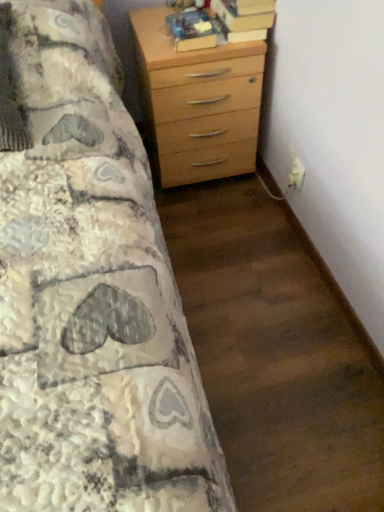
Question: Considering the relative sizes of hardcover book at upper right, the 2th book positioned from the left, and hardcover book at upper center, which ranks as the 1th book in left-to-right order, in the image provided, is hardcover book at upper right, the 2th book positioned from the left, shorter than hardcover book at upper center, which ranks as the 1th book in left-to-right order,?

Choices:
 (A) yes
 (B) no

Answer: (A)

Question: From the image's perspective, is hardcover book at upper right, the 2th book positioned from the left, located beneath hardcover book at upper center, marked as the second book in a right-to-left arrangement?

Choices:
 (A) yes
 (B) no

Answer: (B)

Question: Considering the relative sizes of hardcover book at upper right, the 2th book positioned from the left, and hardcover book at upper center, which ranks as the 1th book in left-to-right order, in the image provided, is hardcover book at upper right, the 2th book positioned from the left, taller than hardcover book at upper center, which ranks as the 1th book in left-to-right order,?

Choices:
 (A) yes
 (B) no

Answer: (B)

Question: From a real-world perspective, is hardcover book at upper right, placed as the 1th book when sorted from right to left, over hardcover book at upper center, which ranks as the 1th book in left-to-right order?

Choices:
 (A) yes
 (B) no

Answer: (A)

Question: Does hardcover book at upper right, the 2th book positioned from the left, have a larger size compared to hardcover book at upper center, marked as the second book in a right-to-left arrangement?

Choices:
 (A) no
 (B) yes

Answer: (B)

Question: In terms of size, does light wood chest of drawers at upper right appear bigger or smaller than hardcover book at upper right, placed as the 1th book when sorted from right to left?

Choices:
 (A) big
 (B) small

Answer: (A)

Question: Would you say light wood chest of drawers at upper right is to the left or to the right of hardcover book at upper right, the 2th book positioned from the left, in the picture?

Choices:
 (A) right
 (B) left

Answer: (B)

Question: Considering the positions of light wood chest of drawers at upper right and hardcover book at upper right, the 2th book positioned from the left, in the image, is light wood chest of drawers at upper right wider or thinner than hardcover book at upper right, the 2th book positioned from the left,?

Choices:
 (A) thin
 (B) wide

Answer: (B)

Question: From a real-world perspective, relative to hardcover book at upper right, placed as the 1th book when sorted from right to left, is light wood chest of drawers at upper right vertically above or below?

Choices:
 (A) below
 (B) above

Answer: (A)

Question: Is hardcover book at upper right, the 2th book positioned from the left, inside the boundaries of light wood chest of drawers at upper right, or outside?

Choices:
 (A) inside
 (B) outside

Answer: (B)

Question: In terms of height, does hardcover book at upper right, the 2th book positioned from the left, look taller or shorter compared to light wood chest of drawers at upper right?

Choices:
 (A) short
 (B) tall

Answer: (A)

Question: In the image, is hardcover book at upper right, the 2th book positioned from the left, on the left side or the right side of light wood chest of drawers at upper right?

Choices:
 (A) right
 (B) left

Answer: (A)

Question: In terms of width, does hardcover book at upper right, placed as the 1th book when sorted from right to left, look wider or thinner when compared to light wood chest of drawers at upper right?

Choices:
 (A) wide
 (B) thin

Answer: (B)

Question: From a real-world perspective, is hardcover book at upper center, marked as the second book in a right-to-left arrangement, positioned above or below hardcover book at upper right, placed as the 1th book when sorted from right to left?

Choices:
 (A) below
 (B) above

Answer: (A)

Question: From the image's perspective, relative to hardcover book at upper right, placed as the 1th book when sorted from right to left, is hardcover book at upper center, which ranks as the 1th book in left-to-right order, above or below?

Choices:
 (A) above
 (B) below

Answer: (B)